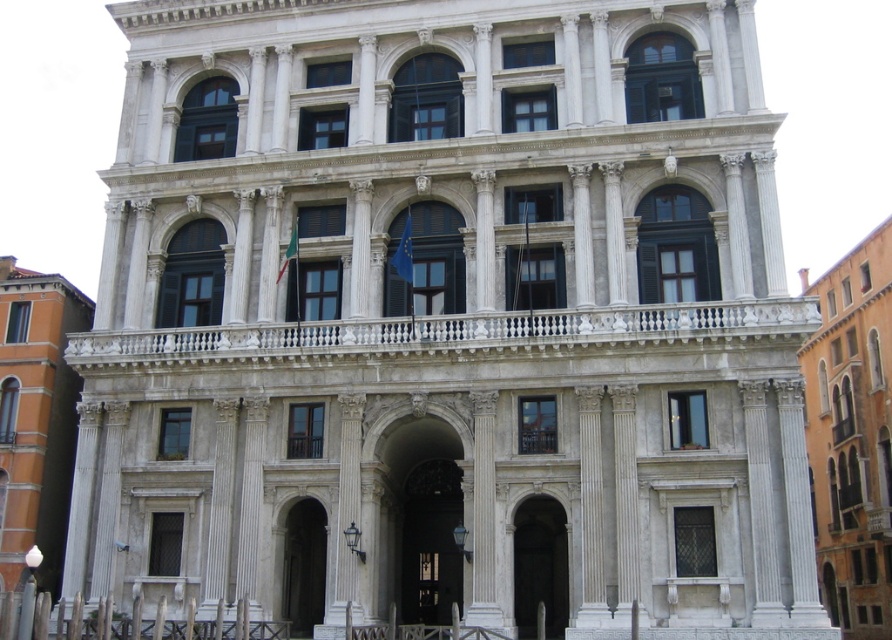
Question: From the image, what is the correct spatial relationship of orange brick building at left in relation to white marble arch at center?

Choices:
 (A) left
 (B) right

Answer: (A)

Question: Which of the following is the closest to the observer?

Choices:
 (A) orange stucco building at right
 (B) orange brick building at left
 (C) dark wood door at center

Answer: (A)

Question: Which of the following is the closest to the observer?

Choices:
 (A) smooth stone archway at center
 (B) dark wood door at center
 (C) orange stucco building at right
 (D) orange brick building at left

Answer: (C)

Question: Can you confirm if orange stucco building at right is bigger than smooth stone archway at center?

Choices:
 (A) no
 (B) yes

Answer: (B)

Question: Which object appears farthest from the camera in this image?

Choices:
 (A) smooth stone archway at center
 (B) orange stucco building at right
 (C) orange brick building at left
 (D) dark wood door at center

Answer: (C)

Question: Is orange stucco building at right thinner than orange brick building at left?

Choices:
 (A) yes
 (B) no

Answer: (B)